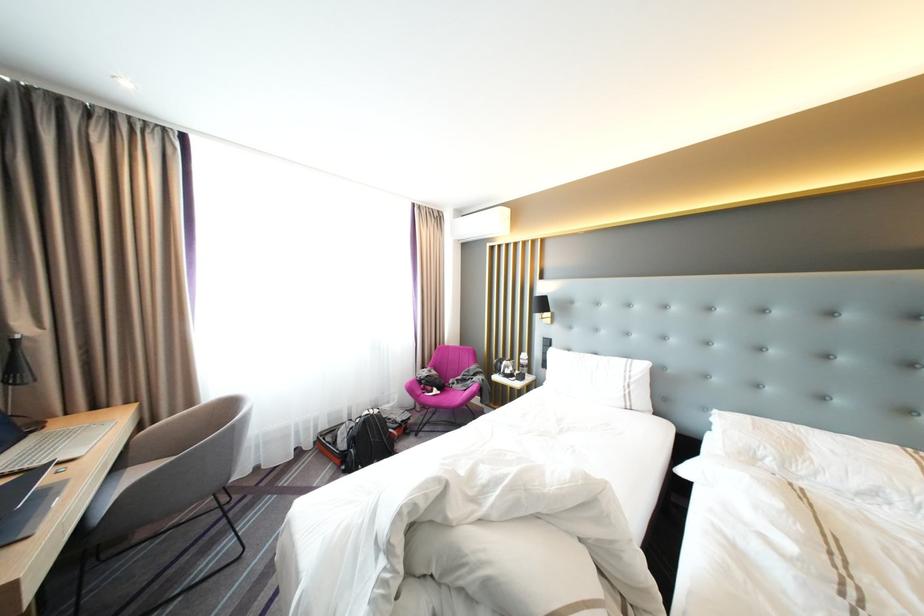
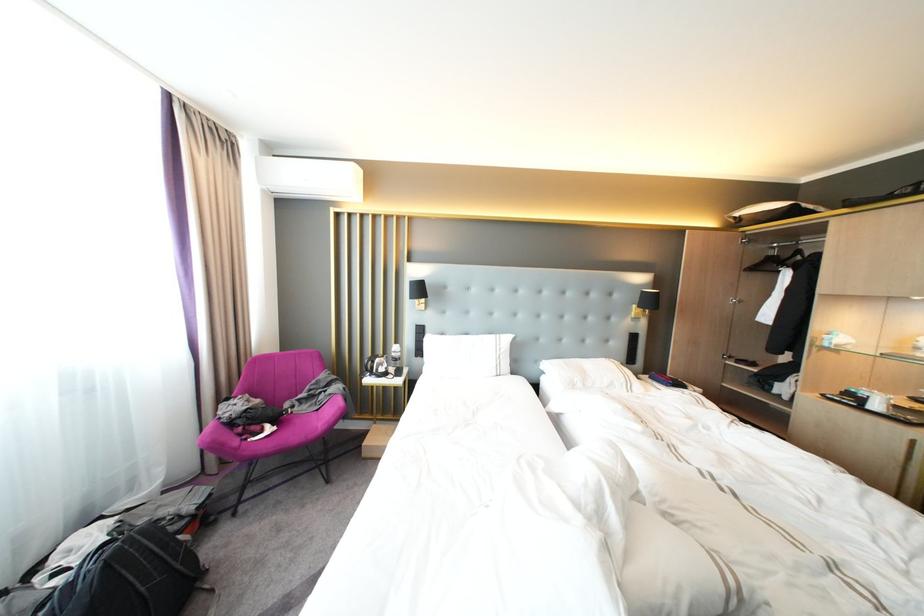
Where in the second image is the point corresponding to the point at 395,438 from the first image?

(186, 564)